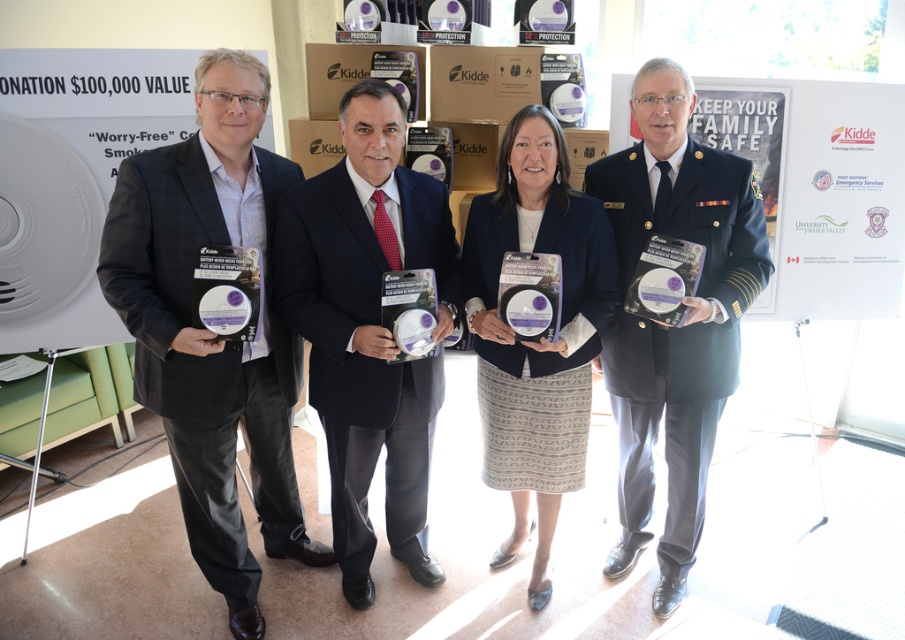
You are organizing a photo shoot and need to ensure that the matte black suit at left and the dark blue uniform at center are spaced exactly 1.2 meters apart for a professional look. Based on the scene description, does their current positioning meet this requirement?

The distance between the matte black suit at left and the dark blue uniform at center is 1.23 meters, which is slightly more than the required 1.2 meters. Adjusting them to be 1.2 meters apart would meet the requirement.